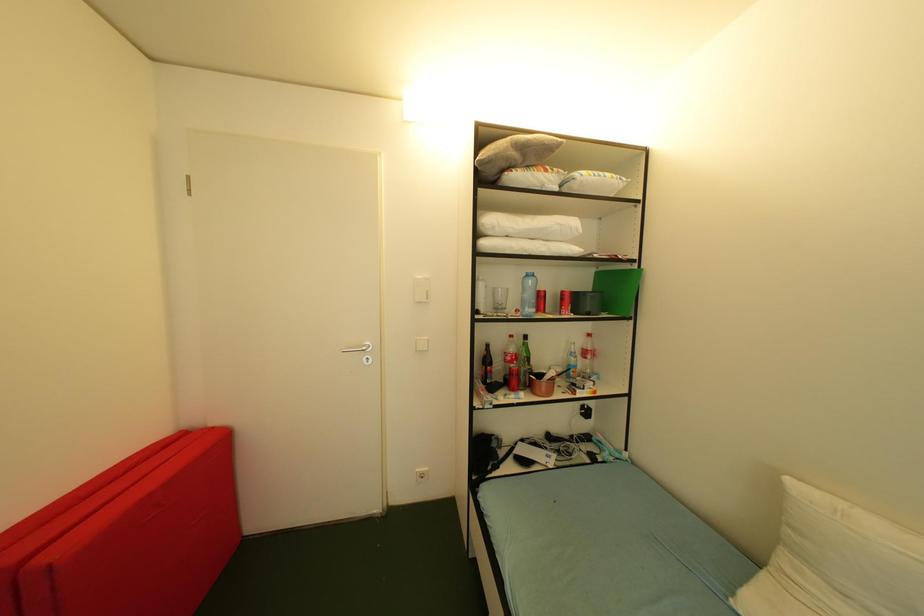
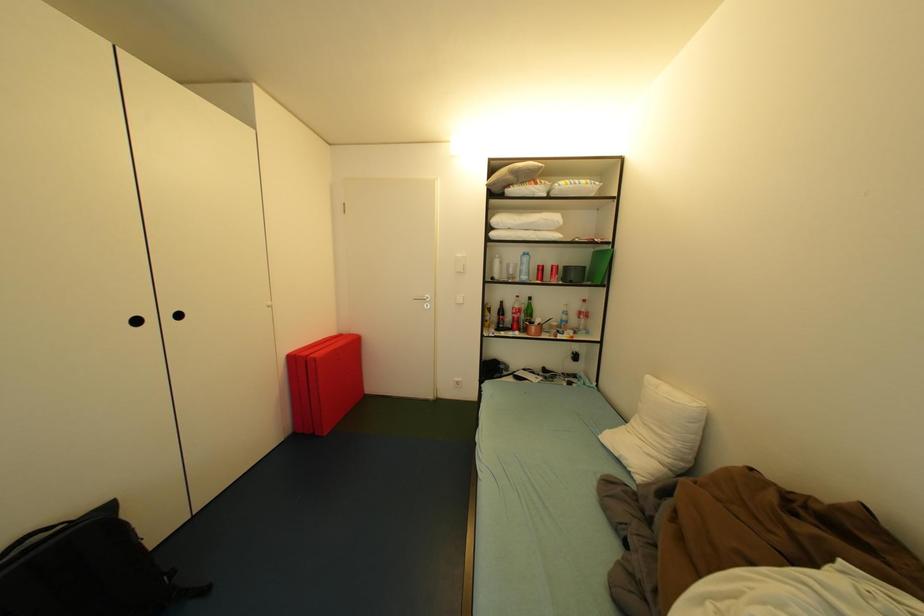
In a continuous first-person perspective shot, in which direction is the camera moving?

The cameraman moved toward right, backward.